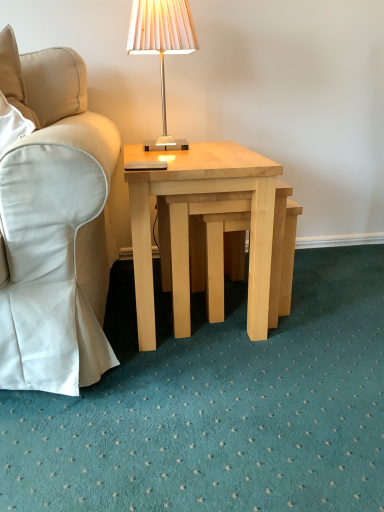
Locate an element on the screen. vacant space to the right of light wood/natural wood coffee table at center is located at coordinates (335, 322).